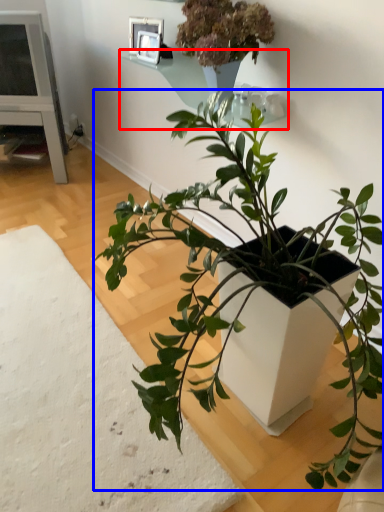
Question: Which object is closer to the camera taking this photo, window sill (highlighted by a red box) or houseplant (highlighted by a blue box)?

Choices:
 (A) window sill
 (B) houseplant

Answer: (B)